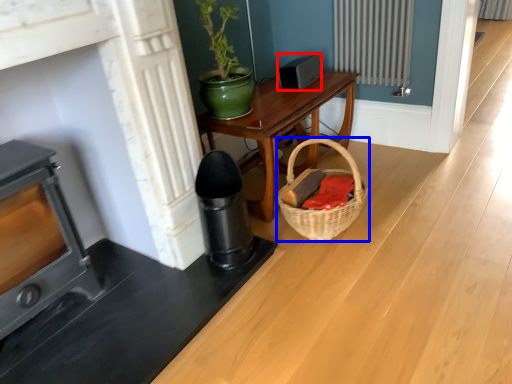
Question: Which point is closer to the camera, appliance (highlighted by a red box) or basket (highlighted by a blue box)?

Choices:
 (A) appliance
 (B) basket

Answer: (B)